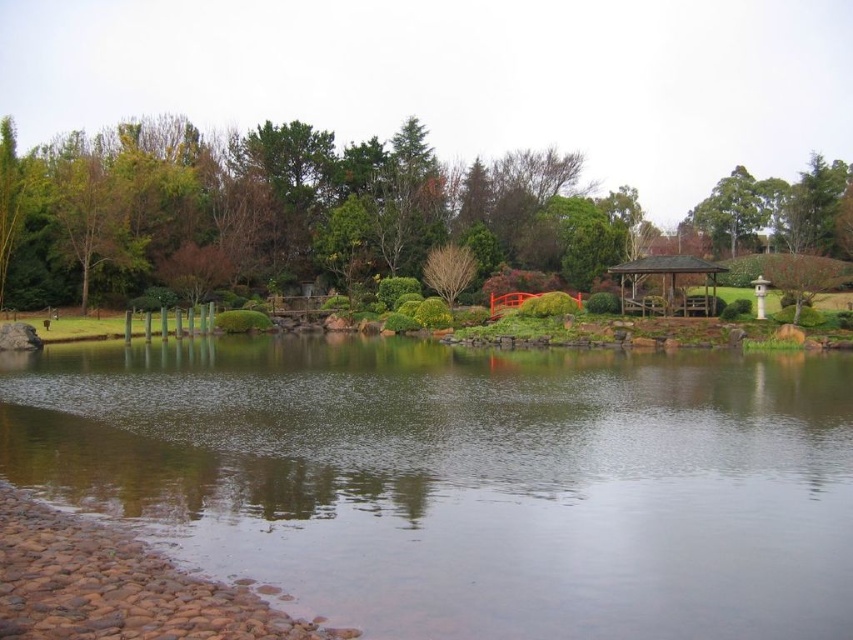
Question: Which point is farther to the camera?

Choices:
 (A) bare wood tree at center
 (B) green leafy tree at upper right
 (C) green leafy tree at upper center

Answer: (B)

Question: Considering the relative positions of clear water at center and bare wood tree at center in the image provided, where is clear water at center located with respect to bare wood tree at center?

Choices:
 (A) below
 (B) above

Answer: (A)

Question: Is green leafy tree at upper center positioned in front of bare wood tree at center?

Choices:
 (A) no
 (B) yes

Answer: (B)

Question: Which of the following is the farthest from the observer?

Choices:
 (A) green leafy tree at upper center
 (B) bare wood tree at center
 (C) green leafy tree at upper right
 (D) brown wooden gazebo at center-right

Answer: (C)

Question: Can you confirm if clear water at center is thinner than brown wooden gazebo at center-right?

Choices:
 (A) no
 (B) yes

Answer: (A)

Question: Among these points, which one is farthest from the camera?

Choices:
 (A) (784, 516)
 (B) (729, 188)

Answer: (B)